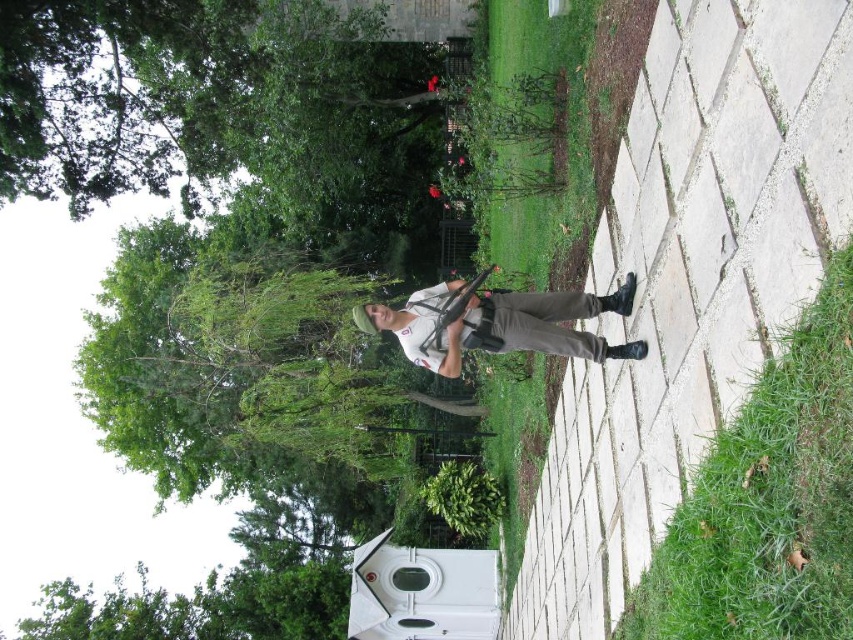
You are standing at the camera position and want to determine which of the two points, point (842, 412) or point (502, 410), is closer to you. Based on the scene description, which point is nearer?

A: Point (842, 412) is closer to the camera than point (502, 410), so it is the nearer point.

You are standing on the paved pathway and want to take a photo of the green grass at center. Which direction should you face to capture it in your camera view?

The green grass at center is located at point 0.223 on the x and 0.627 on the y axis, so you should face towards the center of the image to capture it.

You are a gardener who needs to mow the lawn. You see green grass at lower right and green grass at center. Which area requires mowing first if you prioritize shorter grass?

The green grass at lower right is shorter than the green grass at center, so you should mow the green grass at center first to maintain even length.